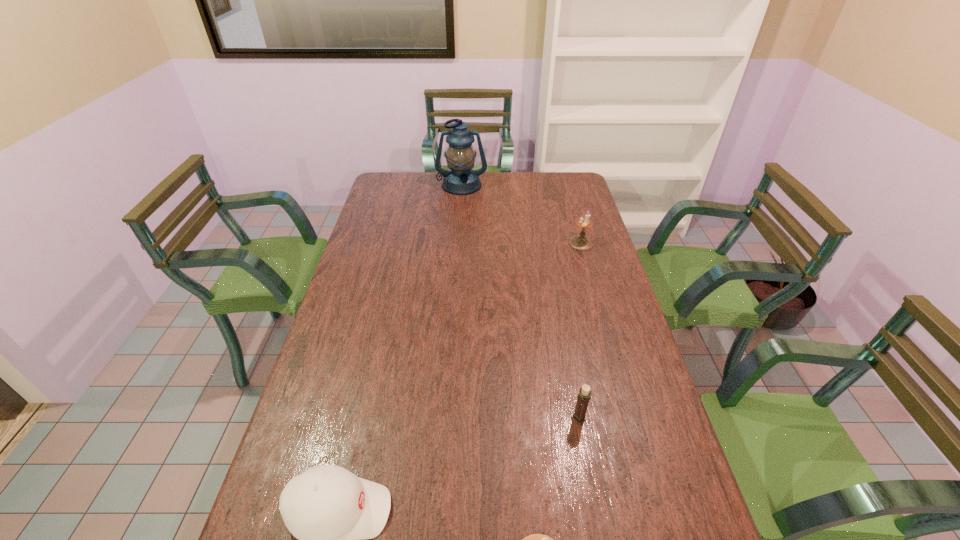
You are a GUI agent. You are given a task and a screenshot of the screen. Output one action in this format:
    pyautogui.click(x=<x>, y=<y>)
    Task: Click on the vacant space that satisfies the following two spatial constraints: 1. on the face of the second candle holder from right to left; 2. on the left side of the farthest object
    
    Given the screenshot: What is the action you would take?
    pyautogui.click(x=447, y=418)

At what (x,y) coordinates should I click in order to perform the action: click on free space that satisfies the following two spatial constraints: 1. on the face of the lantern; 2. on the right side of the second farthest candle holder. Please return your answer as a coordinate pair (x, y). The height and width of the screenshot is (540, 960). Looking at the image, I should click on (447, 418).

Find the location of a particular element. This screenshot has height=540, width=960. blank space that satisfies the following two spatial constraints: 1. on the face of the farthest candle holder; 2. on the left side of the farthest object is located at coordinates (458, 243).